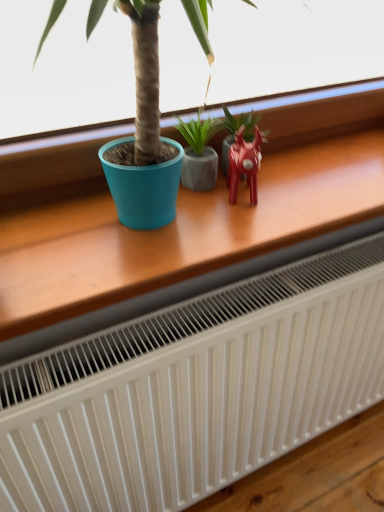
Question: Is wooden table at center thinner than glossy ceramic plant at center, the 1th houseplant positioned from the right?

Choices:
 (A) yes
 (B) no

Answer: (B)

Question: Is glossy ceramic plant at center, the second houseplant when ordered from left to right, completely or partially inside wooden table at center?

Choices:
 (A) no
 (B) yes

Answer: (B)

Question: Can you confirm if wooden table at center is wider than glossy ceramic plant at center, the second houseplant when ordered from left to right?

Choices:
 (A) no
 (B) yes

Answer: (B)

Question: From the image's perspective, is wooden table at center on top of glossy ceramic plant at center, the second houseplant when ordered from left to right?

Choices:
 (A) yes
 (B) no

Answer: (B)

Question: Is wooden table at center at the left side of glossy ceramic plant at center, the second houseplant when ordered from left to right?

Choices:
 (A) no
 (B) yes

Answer: (B)

Question: From a real-world perspective, is matte gray pot at center, the 2th houseplant when ordered from right to left, positioned above or below glossy plastic reindeer at center right?

Choices:
 (A) below
 (B) above

Answer: (A)

Question: Does point (213, 161) appear closer or farther from the camera than point (243, 157)?

Choices:
 (A) closer
 (B) farther

Answer: (B)

Question: Relative to glossy plastic reindeer at center right, is matte gray pot at center, the 2th houseplant when ordered from right to left, in front or behind?

Choices:
 (A) front
 (B) behind

Answer: (B)

Question: Considering the relative positions of matte gray pot at center, the 2th houseplant when ordered from right to left, and glossy plastic reindeer at center right in the image provided, is matte gray pot at center, the 2th houseplant when ordered from right to left, to the left or to the right of glossy plastic reindeer at center right?

Choices:
 (A) right
 (B) left

Answer: (B)

Question: Does point (246, 167) appear closer or farther from the camera than point (226, 108)?

Choices:
 (A) closer
 (B) farther

Answer: (A)

Question: Relative to glossy ceramic plant at center, the second houseplant when ordered from left to right, is glossy plastic reindeer at center right in front or behind?

Choices:
 (A) behind
 (B) front

Answer: (B)

Question: Considering the positions of glossy plastic reindeer at center right and glossy ceramic plant at center, the 1th houseplant positioned from the right, in the image, is glossy plastic reindeer at center right bigger or smaller than glossy ceramic plant at center, the 1th houseplant positioned from the right,?

Choices:
 (A) small
 (B) big

Answer: (A)

Question: In terms of height, does glossy plastic reindeer at center right look taller or shorter compared to glossy ceramic plant at center, the 1th houseplant positioned from the right?

Choices:
 (A) tall
 (B) short

Answer: (A)

Question: Based on their sizes in the image, would you say matte gray pot at center, the 2th houseplant when ordered from right to left, is bigger or smaller than wooden table at center?

Choices:
 (A) big
 (B) small

Answer: (B)

Question: Is matte gray pot at center, which is counted as the first houseplant, starting from the left, spatially inside wooden table at center, or outside of it?

Choices:
 (A) inside
 (B) outside

Answer: (A)